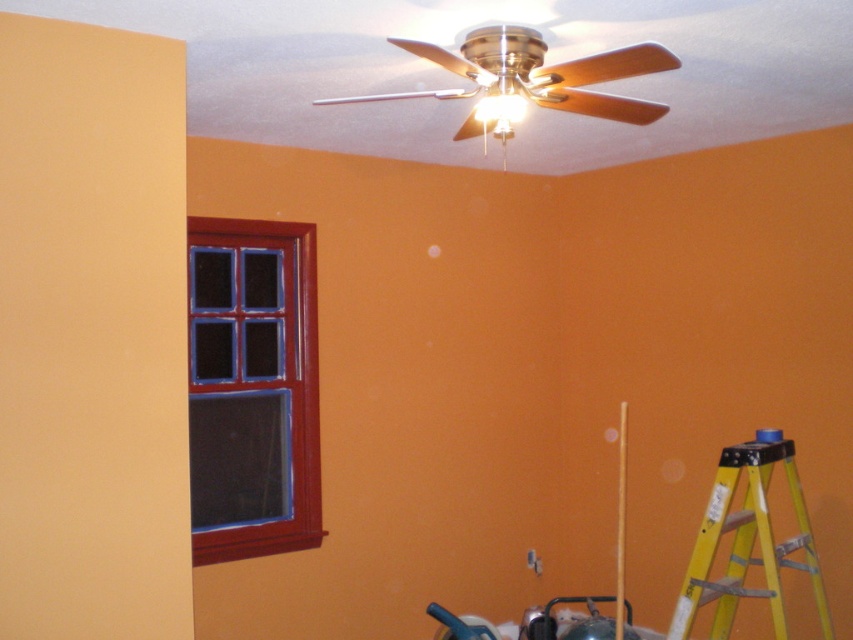
Question: Based on their relative distances, which object is farther from the yellow/yellowish metal ladder at lower right?

Choices:
 (A) matte red wooden window at left
 (B) brushed metal fan at upper center

Answer: (A)

Question: Which object is positioned closest to the matte red wooden window at left?

Choices:
 (A) brushed metal fan at upper center
 (B) yellow/yellowish metal ladder at lower right

Answer: (A)

Question: Which is farther from the yellow/yellowish metal ladder at lower right?

Choices:
 (A) matte red wooden window at left
 (B) brushed metal fan at upper center

Answer: (A)

Question: Can you confirm if matte red wooden window at left is positioned to the right of brushed metal fan at upper center?

Choices:
 (A) yes
 (B) no

Answer: (B)

Question: Can you confirm if matte red wooden window at left is positioned below yellow/yellowish metal ladder at lower right?

Choices:
 (A) yes
 (B) no

Answer: (B)

Question: In this image, where is matte red wooden window at left located relative to yellow/yellowish metal ladder at lower right?

Choices:
 (A) above
 (B) below

Answer: (A)